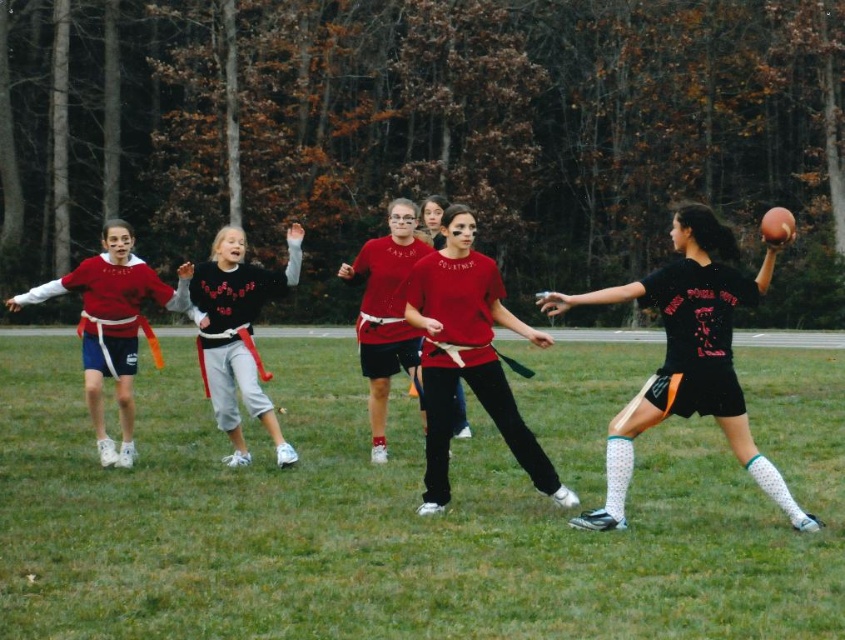
Can you confirm if green grass football field at center is thinner than black matte jersey at right?

No.

Between point (717, 522) and point (682, 218), which one is positioned behind?

Positioned behind is point (717, 522).

The height and width of the screenshot is (640, 845). What are the coordinates of `green grass football field at center` in the screenshot? It's located at (401, 518).

Between green grass football field at center and matte red shirt at center, which one is positioned higher?

matte red shirt at center is above.

Measure the distance between green grass football field at center and matte red shirt at center.

green grass football field at center and matte red shirt at center are 9.04 feet apart.

Is point (527, 420) positioned behind point (494, 403)?

Yes, it is behind point (494, 403).

This screenshot has height=640, width=845. Find the location of `green grass football field at center`. green grass football field at center is located at coordinates (401, 518).

Is point (443, 465) closer to camera compared to point (200, 273)?

Yes.

Measure the distance between matte red shirt at center and black fleece sweatshirt at center.

matte red shirt at center is 2.16 meters from black fleece sweatshirt at center.

Between point (535, 333) and point (243, 280), which one is positioned in front?

Positioned in front is point (535, 333).

Identify the location of matte red shirt at center. (x=467, y=356).